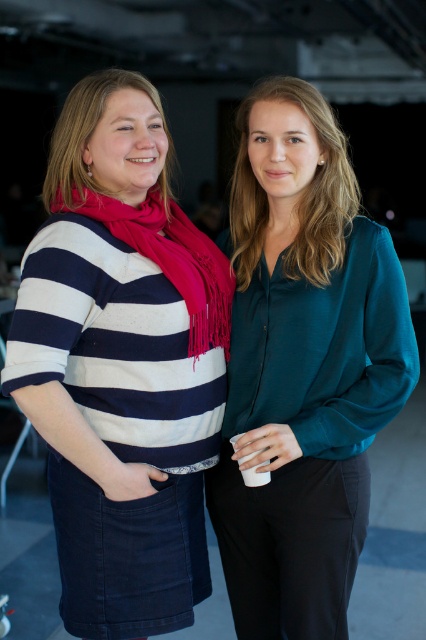
Is striped wool sweater at center closer to camera compared to matte red scarf at center?

Yes, striped wool sweater at center is closer to the viewer.

Find the location of a particular element. The image size is (426, 640). striped wool sweater at center is located at coordinates (121, 364).

The image size is (426, 640). I want to click on striped wool sweater at center, so pyautogui.click(x=121, y=364).

Based on the photo, does teal silk blouse at center have a larger size compared to matte red scarf at center?

Yes.

Image resolution: width=426 pixels, height=640 pixels. What are the coordinates of `teal silk blouse at center` in the screenshot? It's located at (302, 369).

Is striped wool sweater at center shorter than teal silk blouse at center?

Indeed, striped wool sweater at center has a lesser height compared to teal silk blouse at center.

Can you confirm if striped wool sweater at center is positioned to the right of teal silk blouse at center?

Incorrect, striped wool sweater at center is not on the right side of teal silk blouse at center.

Find the location of a particular element. This screenshot has height=640, width=426. striped wool sweater at center is located at coordinates (121, 364).